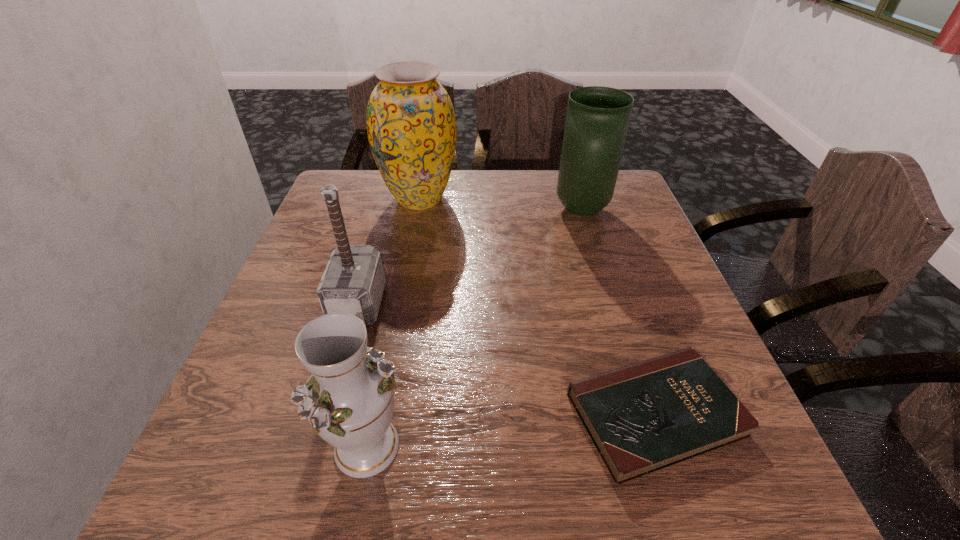
The width and height of the screenshot is (960, 540). In order to click on the rightmost vase in this screenshot , I will do `click(597, 119)`.

Locate an element on the screen. This screenshot has width=960, height=540. the third farthest object is located at coordinates (353, 282).

Identify the location of the nearest vase. (349, 399).

The height and width of the screenshot is (540, 960). In order to click on the shortest object in this screenshot , I will do `click(643, 417)`.

Identify the location of free spot located on the front of the rightmost vase. The width and height of the screenshot is (960, 540). (620, 335).

Locate an element on the screen. free space located for striking with the head of the hammer is located at coordinates (450, 303).

Locate an element on the screen. Image resolution: width=960 pixels, height=540 pixels. free space located 0.200m on the back of the shortest vase is located at coordinates (392, 319).

Where is `vacant space located 0.190m on the left of the shortest object`? vacant space located 0.190m on the left of the shortest object is located at coordinates (454, 414).

The height and width of the screenshot is (540, 960). Find the location of `vase present at the near edge`. vase present at the near edge is located at coordinates (349, 399).

Where is `Bible that is at the near edge`? Image resolution: width=960 pixels, height=540 pixels. Bible that is at the near edge is located at coordinates (643, 417).